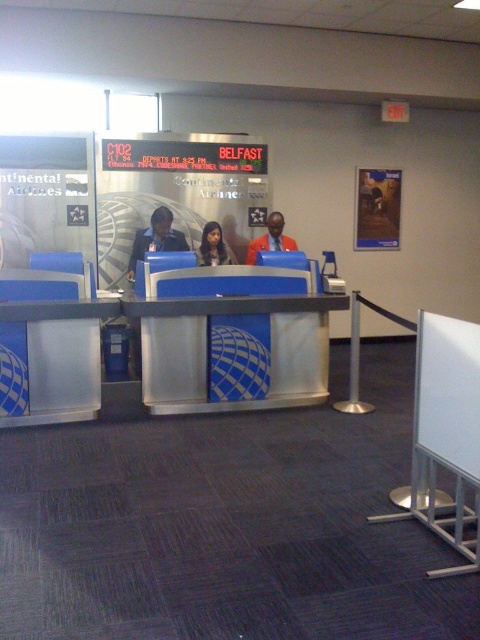
You are a customer at the Continental Airlines checkin counter. You see the metallic silver desk at center and the blue fabric uniform at center. Which object takes up more space in the image?

The metallic silver desk at center is bigger than the blue fabric uniform at center, so it takes up more space in the image.

You are a passenger at the Continental Airlines check in counter. You see the metallic silver desk at center and the orange fabric jacket at center. Which object is closer to you?

The metallic silver desk at center is closer to you because it is in front of the orange fabric jacket at center.

You are a passenger at the Continental Airlines checkin counter. You notice two staff members at the counter. One is wearing a blue fabric uniform at center and the other has a smooth skin face at center. Which staff member is standing to the left of the other?

The blue fabric uniform at center is positioned on the left side of smooth skin face at center, so the staff member wearing the blue fabric uniform at center is standing to the left of the one with the smooth skin face at center.